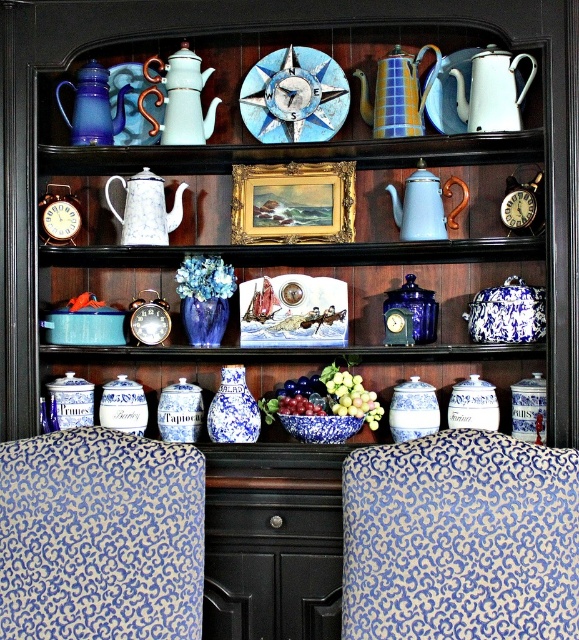
Question: Is blue patterned fabric chair at lower left wider than blue porcelain jar at center?

Choices:
 (A) yes
 (B) no

Answer: (A)

Question: Which point is farther from the camera taking this photo?

Choices:
 (A) (397, 198)
 (B) (218, 388)
 (C) (192, 60)
 (D) (325, 100)

Answer: (B)

Question: Among these points, which one is nearest to the camera?

Choices:
 (A) [291, 58]
 (B) [455, 56]

Answer: (B)

Question: Which of the following is the closest to the observer?

Choices:
 (A) blue and yellow ceramic teapot at upper center
 (B) white porcelain teapot at upper left

Answer: (A)

Question: Does white enamel teapot at upper right come in front of matte white teapot at center?

Choices:
 (A) no
 (B) yes

Answer: (B)

Question: Is blue and white porcelain vase at center to the left of blue glossy vase at center from the viewer's perspective?

Choices:
 (A) yes
 (B) no

Answer: (B)